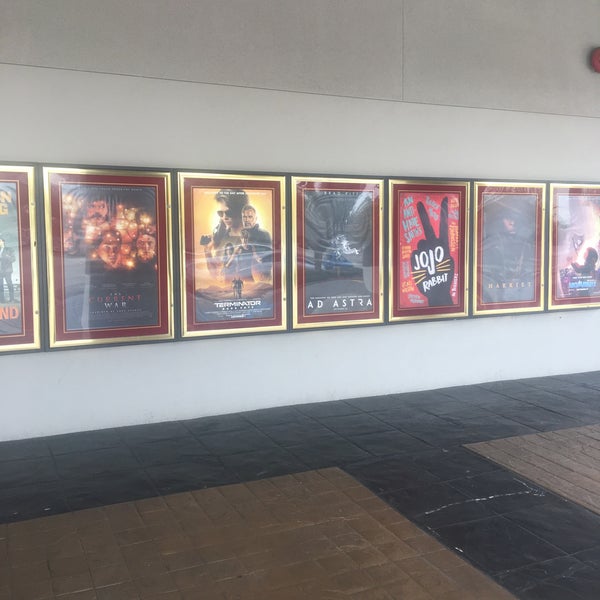
You are a GUI agent. You are given a task and a screenshot of the screen. Output one action in this format:
    pyautogui.click(x=<x>, y=<y>)
    Task: Click on the poster
    The width and height of the screenshot is (600, 600).
    Given the screenshot: What is the action you would take?
    pyautogui.click(x=571, y=292)